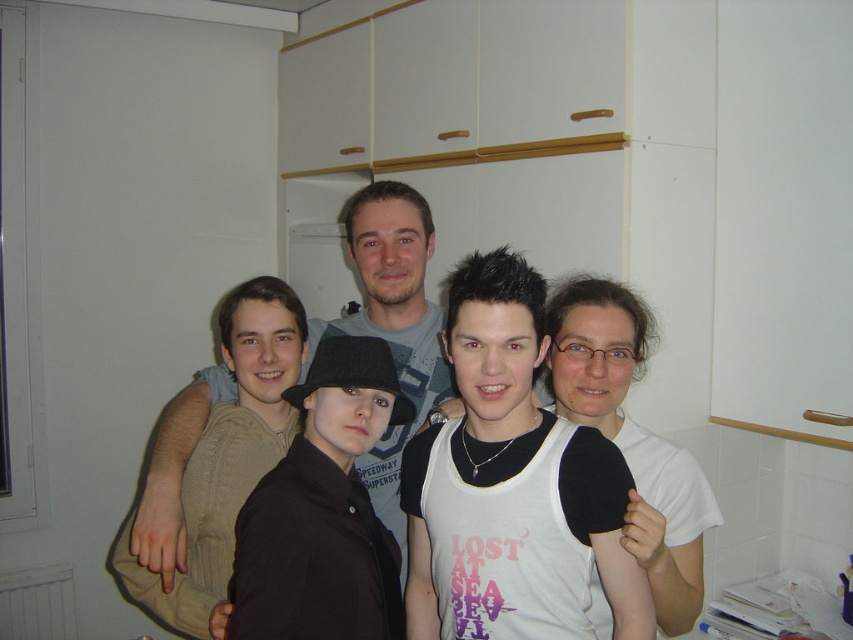
Question: Is black matte hat at center thinner than matte gray shirt at center?

Choices:
 (A) no
 (B) yes

Answer: (B)

Question: Is black matte hat at center thinner than matte gray shirt at center?

Choices:
 (A) yes
 (B) no

Answer: (A)

Question: Which point is farther from the camera taking this photo?

Choices:
 (A) (317, 604)
 (B) (387, 509)

Answer: (B)

Question: Can you confirm if black matte hat at center is wider than matte gray shirt at center?

Choices:
 (A) no
 (B) yes

Answer: (A)

Question: Among these points, which one is nearest to the camera?

Choices:
 (A) (171, 499)
 (B) (335, 614)

Answer: (B)